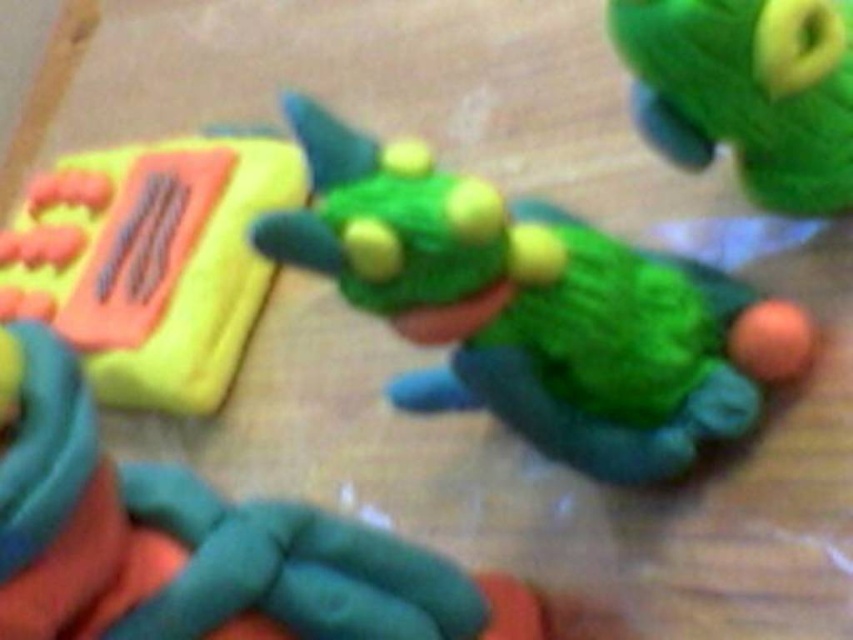
You are organizing a display of turtle sculptures for an art exhibition. You have a matte green clay turtle at center and a green fuzzy turtle at upper right. Which turtle sculpture should you place on the larger pedestal to match their sizes?

The matte green clay turtle at center is larger in size than the green fuzzy turtle at upper right, so it should be placed on the larger pedestal to match their sizes.